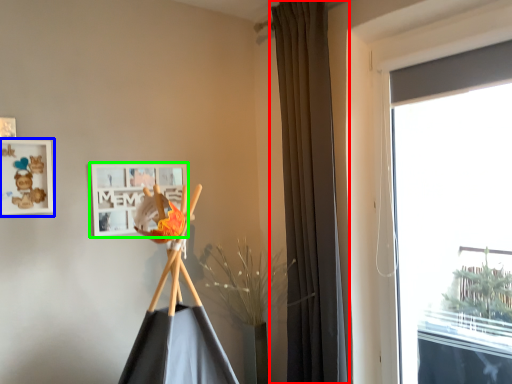
Question: Estimate the real-world distances between objects in this image. Which object is closer to curtain (highlighted by a red box), picture frame (highlighted by a blue box) or picture frame (highlighted by a green box)?

Choices:
 (A) picture frame
 (B) picture frame

Answer: (B)